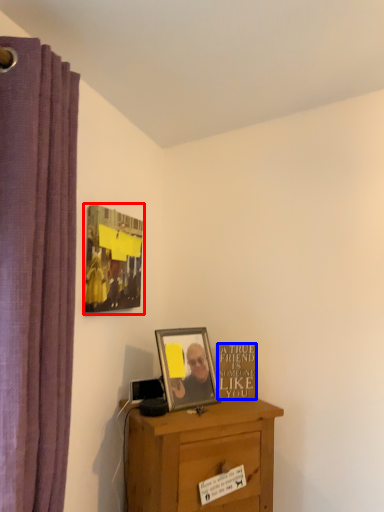
Question: Which point is closer to the camera, picture frame (highlighted by a red box) or writing (highlighted by a blue box)?

Choices:
 (A) picture frame
 (B) writing

Answer: (A)